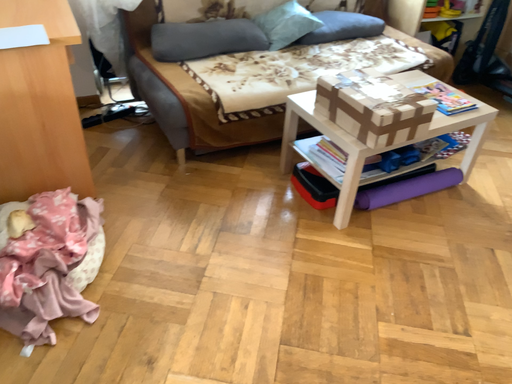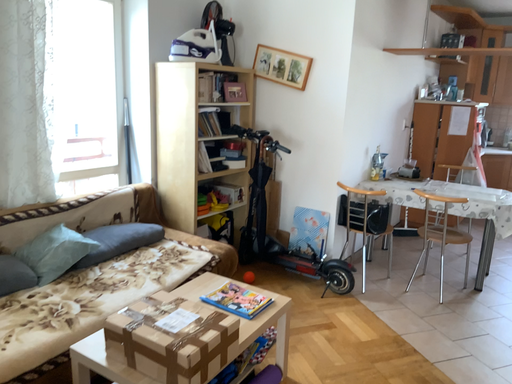
Question: How did the camera likely rotate when shooting the video?

Choices:
 (A) rotated left
 (B) rotated right

Answer: (B)